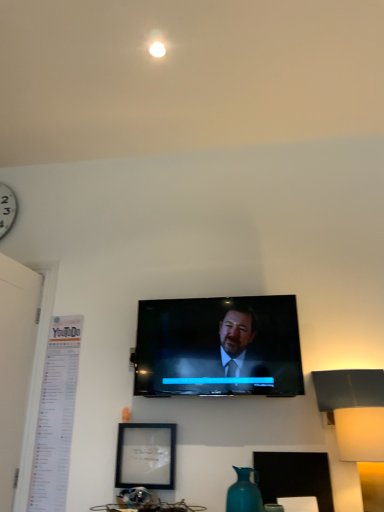
Question: From their relative heights in the image, would you say matte black picture frame at lower center is taller or shorter than white matte table lamp at right?

Choices:
 (A) tall
 (B) short

Answer: (B)

Question: In terms of width, does matte black picture frame at lower center look wider or thinner when compared to white matte table lamp at right?

Choices:
 (A) wide
 (B) thin

Answer: (B)

Question: Which object is positioned closest to the matte black picture frame at lower center?

Choices:
 (A) white matte table lamp at right
 (B) matte black tv at center
 (C) teal ceramic vase at lower center

Answer: (B)

Question: Which of these objects is positioned closest to the matte black picture frame at lower center?

Choices:
 (A) matte black tv at center
 (B) teal ceramic vase at lower center
 (C) white matte table lamp at right

Answer: (A)